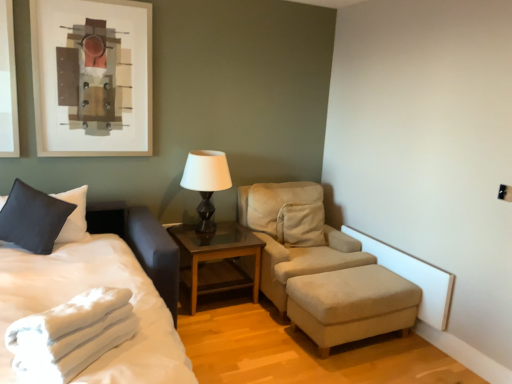
This screenshot has width=512, height=384. What do you see at coordinates (90, 288) in the screenshot?
I see `white soft bed at left` at bounding box center [90, 288].

What do you see at coordinates (42, 217) in the screenshot? I see `matte black pillow at left` at bounding box center [42, 217].

At what (x,y) coordinates should I click in order to perform the action: click on white soft bed at left. Please return your answer as a coordinate pair (x, y). The image size is (512, 384). Looking at the image, I should click on (90, 288).

Between white soft bed at left and matte black pillow at left, which one has smaller width?

matte black pillow at left is thinner.

Would you say white soft bed at left is inside or outside matte black pillow at left?

The correct answer is: outside.

Which of these two, white soft bed at left or matte black pillow at left, is bigger?

Bigger between the two is white soft bed at left.

From the image's perspective, is matte black pillow at left on top of white soft towel at lower left?

Yes.

Is matte black pillow at left far from white soft towel at lower left?

matte black pillow at left is positioned a significant distance from white soft towel at lower left.

Considering the relative sizes of matte black pillow at left and white soft towel at lower left in the image provided, is matte black pillow at left wider than white soft towel at lower left?

In fact, matte black pillow at left might be narrower than white soft towel at lower left.

In terms of height, does matte black pillow at left look taller or shorter compared to white soft towel at lower left?

matte black pillow at left is taller than white soft towel at lower left.

Considering the sizes of matte black pillow at left and brown wooden table at center in the image, is matte black pillow at left wider or thinner than brown wooden table at center?

Considering their sizes, matte black pillow at left looks slimmer than brown wooden table at center.

Which is more to the right, matte black pillow at left or brown wooden table at center?

brown wooden table at center is more to the right.

Considering the relative positions of matte black pillow at left and brown wooden table at center in the image provided, is matte black pillow at left behind brown wooden table at center?

No, it is in front of brown wooden table at center.

Is matte black pillow at left aimed at brown wooden table at center?

No, matte black pillow at left is not aimed at brown wooden table at center.

From a real-world perspective, is white soft towel at lower left over white soft bed at left?

Yes, from a real-world perspective, white soft towel at lower left is over white soft bed at left

Is white soft towel at lower left turned away from white soft bed at left?

Correct, white soft towel at lower left is looking away from white soft bed at left.

Can you confirm if white soft towel at lower left is bigger than white soft bed at left?

No, white soft towel at lower left is not bigger than white soft bed at left.

Is white soft towel at lower left to the left or to the right of white soft bed at left in the image?

white soft towel at lower left is to the right of white soft bed at left.

Considering the sizes of objects beige fabric ottoman at lower right and beige fabric studio couch at center in the image provided, who is shorter, beige fabric ottoman at lower right or beige fabric studio couch at center?

beige fabric ottoman at lower right is shorter.

Looking at this image, from a real-world perspective, who is located higher, beige fabric ottoman at lower right or beige fabric studio couch at center?

From a 3D spatial view, beige fabric studio couch at center is above.

Consider the image. Considering the positions of objects beige fabric ottoman at lower right and beige fabric studio couch at center in the image provided, who is more to the left, beige fabric ottoman at lower right or beige fabric studio couch at center?

Positioned to the left is beige fabric studio couch at center.

Which is closer to the camera, [372,286] or [306,238]?

Point [372,286] is positioned closer to the camera compared to point [306,238].

From the image's perspective, is beige fabric ottoman at lower right beneath white soft towel at lower left?

Yes, from the image's perspective, beige fabric ottoman at lower right is beneath white soft towel at lower left.

Which is more to the left, beige fabric ottoman at lower right or white soft towel at lower left?

white soft towel at lower left is more to the left.

From the picture: Considering the sizes of objects beige fabric ottoman at lower right and white soft towel at lower left in the image provided, who is thinner, beige fabric ottoman at lower right or white soft towel at lower left?

Thinner between the two is white soft towel at lower left.

How much distance is there between beige fabric ottoman at lower right and white soft towel at lower left?

beige fabric ottoman at lower right and white soft towel at lower left are 5.00 feet apart.

Between point (72, 319) and point (291, 290), which one is positioned behind?

The point (291, 290) is farther.

Between white soft towel at lower left and beige fabric ottoman at lower right, which one has more height?

beige fabric ottoman at lower right.

This screenshot has height=384, width=512. In order to click on blanket that appears above the beige fabric ottoman at lower right (from a real-world perspective) in this screenshot , I will do `click(71, 335)`.

From a real-world perspective, who is located higher, white soft towel at lower left or beige fabric ottoman at lower right?

white soft towel at lower left.

Identify the location of bed on the right of matte black pillow at left. The image size is (512, 384). (90, 288).

Find the location of a particular element. The height and width of the screenshot is (384, 512). blanket lying below the matte black pillow at left (from the image's perspective) is located at coordinates (71, 335).

When comparing their distances from brown wooden table at center, does white soft towel at lower left or white soft bed at left seem closer?

white soft bed at left.

Based on the photo, when comparing their distances from beige fabric studio couch at center, does brown wooden table at center or white soft bed at left seem further?

Based on the image, white soft bed at left appears to be further to beige fabric studio couch at center.

Considering their positions, is matte black table lamp at center positioned closer to beige fabric studio couch at center than white soft towel at lower left?

Based on the image, matte black table lamp at center appears to be nearer to beige fabric studio couch at center.

Which object lies further to the anchor point matte black table lamp at center, beige fabric ottoman at lower right or white soft towel at lower left?

Among the two, white soft towel at lower left is located further to matte black table lamp at center.

From the image, which object appears to be farther from white soft bed at left, beige fabric ottoman at lower right or beige fabric studio couch at center?

beige fabric ottoman at lower right is positioned further to the anchor white soft bed at left.

From the image, which object appears to be nearer to white soft bed at left, brown wooden table at center or white soft towel at lower left?

white soft towel at lower left lies closer to white soft bed at left than the other object.

Which object lies further to the anchor point white soft towel at lower left, beige fabric ottoman at lower right or white soft bed at left?

beige fabric ottoman at lower right is positioned further to the anchor white soft towel at lower left.

Considering their positions, is brown wooden table at center positioned closer to matte black table lamp at center than beige fabric studio couch at center?

Based on the image, brown wooden table at center appears to be nearer to matte black table lamp at center.

Where is `pillow between white soft towel at lower left and matte black table lamp at center along the z-axis`? Image resolution: width=512 pixels, height=384 pixels. pillow between white soft towel at lower left and matte black table lamp at center along the z-axis is located at coordinates (42, 217).

The height and width of the screenshot is (384, 512). What are the coordinates of `stool between white soft towel at lower left and matte black table lamp at center in the front-back direction` in the screenshot? It's located at (351, 304).

The image size is (512, 384). I want to click on blanket between white soft bed at left and brown wooden table at center along the z-axis, so click(x=71, y=335).

At what (x,y) coordinates should I click in order to perform the action: click on table situated between matte black table lamp at center and beige fabric studio couch at center from left to right. Please return your answer as a coordinate pair (x, y). Looking at the image, I should click on (218, 249).